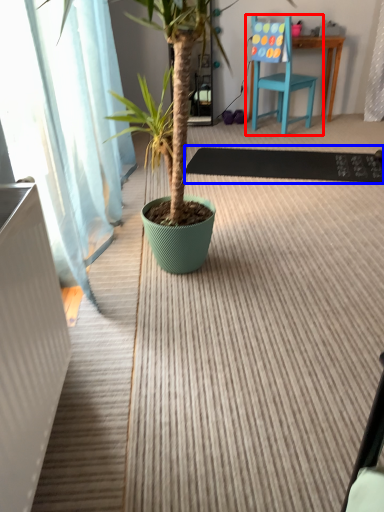
Question: Which of the following is the farthest to the observer, chair (highlighted by a red box) or doormat (highlighted by a blue box)?

Choices:
 (A) chair
 (B) doormat

Answer: (A)